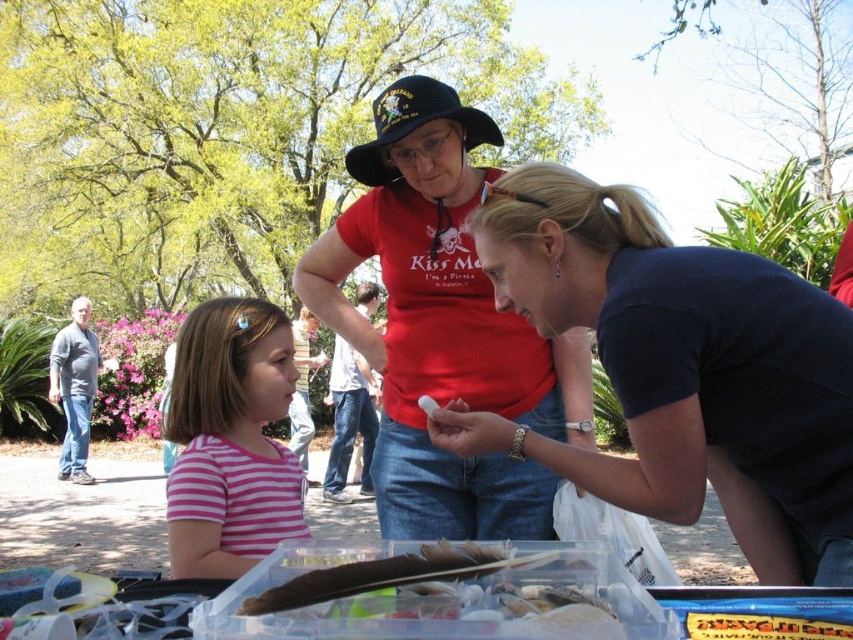
Question: Is pink striped shirt at center smaller than gray cotton shirt at left?

Choices:
 (A) no
 (B) yes

Answer: (B)

Question: Which of these objects is positioned closest to the matte red shirt at center?

Choices:
 (A) black fabric baseball hat at center
 (B) pink striped shirt at center
 (C) dark blue shirt at center
 (D) gray cotton shirt at left

Answer: (A)

Question: Does dark blue shirt at center appear under black fabric baseball hat at center?

Choices:
 (A) no
 (B) yes

Answer: (B)

Question: Which object is farther from the camera taking this photo?

Choices:
 (A) gray cotton shirt at left
 (B) matte red shirt at center
 (C) black fabric baseball hat at center

Answer: (A)

Question: Which point is closer to the camera?

Choices:
 (A) (67, 376)
 (B) (456, 337)

Answer: (B)

Question: Does dark blue shirt at center come in front of matte red shirt at center?

Choices:
 (A) yes
 (B) no

Answer: (A)